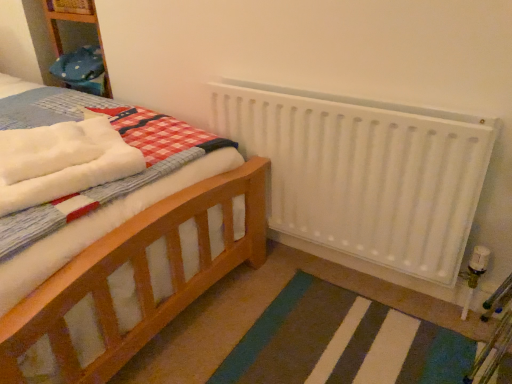
The width and height of the screenshot is (512, 384). In order to click on free area below white matte radiator at upper right (from a real-world perspective) in this screenshot , I will do `click(342, 274)`.